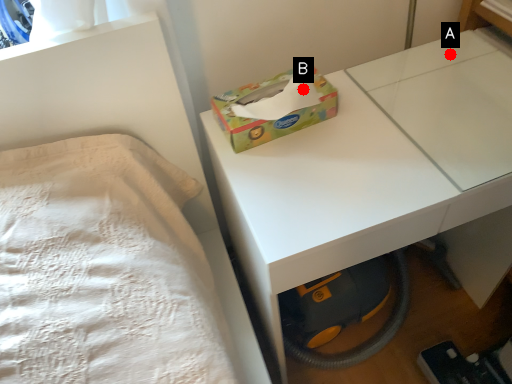
Question: Two points are circled on the image, labeled by A and B beside each circle. Which point appears closest to the camera in this image?

Choices:
 (A) A is closer
 (B) B is closer

Answer: (B)